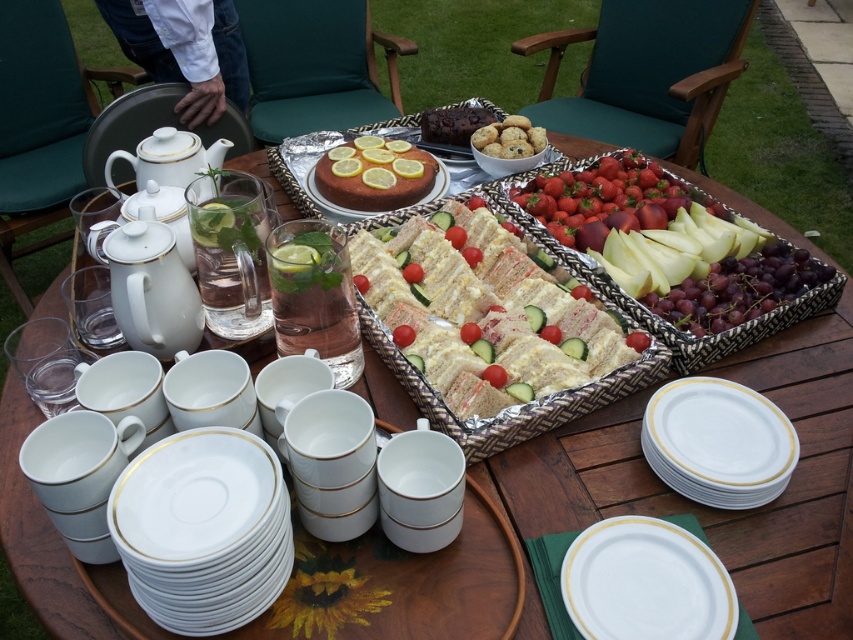
You are setting up an outdoor tea party and need to place a centerpiece between the white ceramic plates at lower right and the white porcelain teapot at upper left. Based on their positions, where should you place the centerpiece?

The white ceramic plates at lower right are to the right of the white porcelain teapot at upper left, so the centerpiece should be placed between them in the center of the table.

You are setting up for a tea party and need to place a rectangular tray that is 12 inches wide. You have space near the white ceramic plates at lower right and the white porcelain teapot at upper left. Which location has enough space for the tray?

The white porcelain teapot at upper left has more width compared to the white ceramic plates at lower right, so the tray can fit near the white porcelain teapot at upper left.